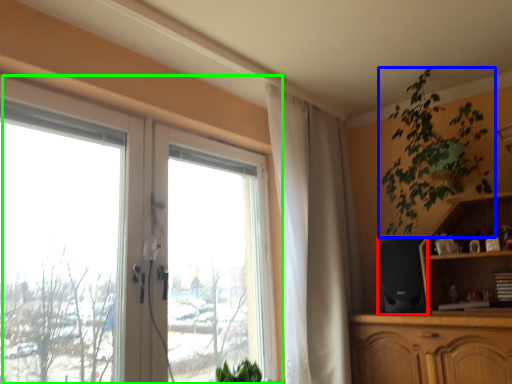
Question: Which is nearer to the speaker (highlighted by a red box)? houseplant (highlighted by a blue box) or window (highlighted by a green box).

Choices:
 (A) houseplant
 (B) window

Answer: (A)